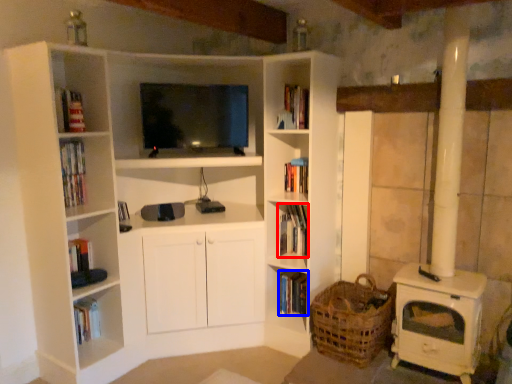
Question: Which point is closer to the camera, book (highlighted by a red box) or book (highlighted by a blue box)?

Choices:
 (A) book
 (B) book

Answer: (A)